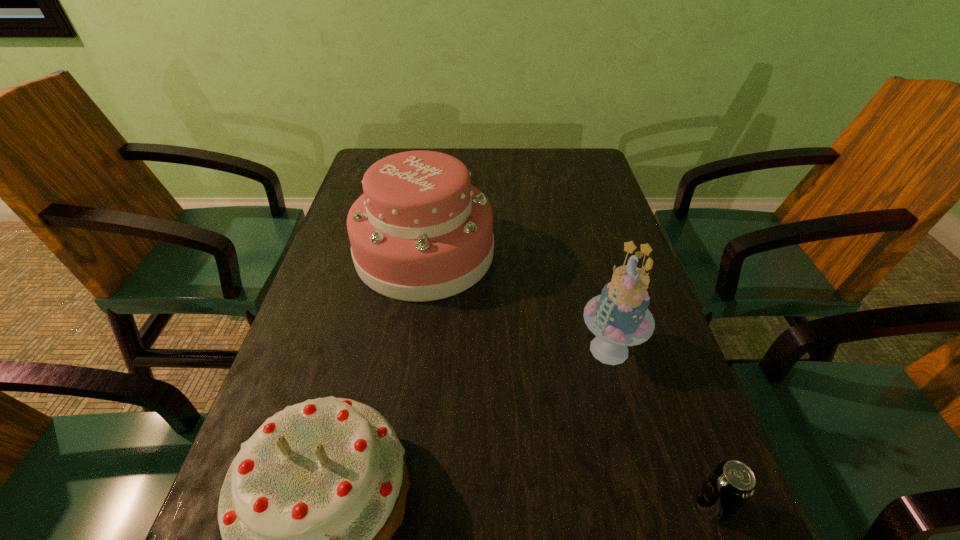
This screenshot has height=540, width=960. What are the coordinates of `object located at the left edge` in the screenshot? It's located at (420, 231).

I want to click on cake that is positioned at the right edge, so click(x=619, y=317).

Where is `soda can at the right edge`? This screenshot has height=540, width=960. soda can at the right edge is located at coordinates (732, 483).

Where is `vacant area at the far edge`? The height and width of the screenshot is (540, 960). vacant area at the far edge is located at coordinates (535, 174).

In the image, there is a desktop. Where is `vacant area at the left edge`? vacant area at the left edge is located at coordinates (349, 349).

This screenshot has width=960, height=540. I want to click on blank area at the right edge, so click(646, 389).

I want to click on vacant space at the far right corner of the desktop, so click(551, 164).

The width and height of the screenshot is (960, 540). Find the location of `unoccupied position between the second farthest cake and the shortest object`. unoccupied position between the second farthest cake and the shortest object is located at coordinates (660, 428).

I want to click on free point between the farthest cake and the rightmost object, so click(568, 379).

Find the location of a particular element. vacant region between the rightmost cake and the shortest object is located at coordinates (660, 428).